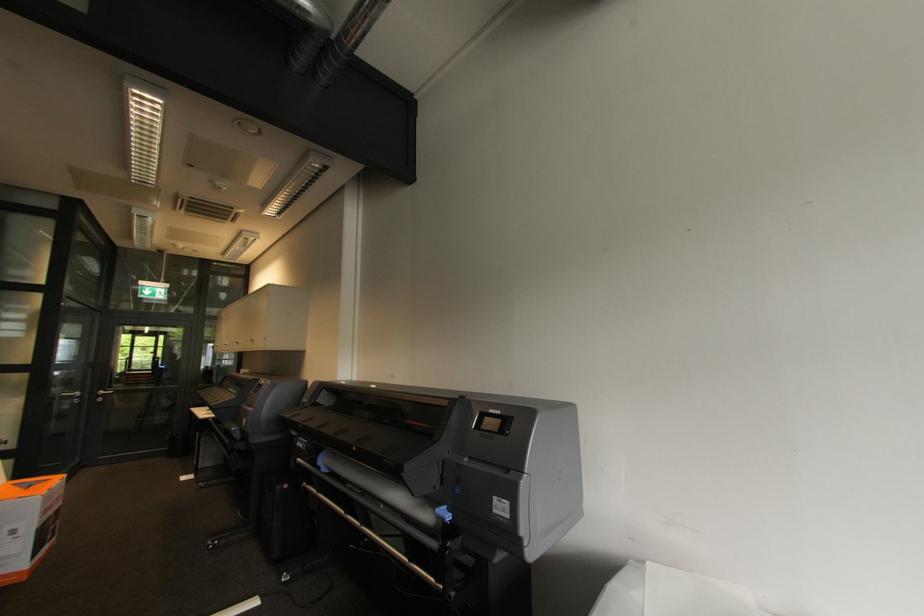
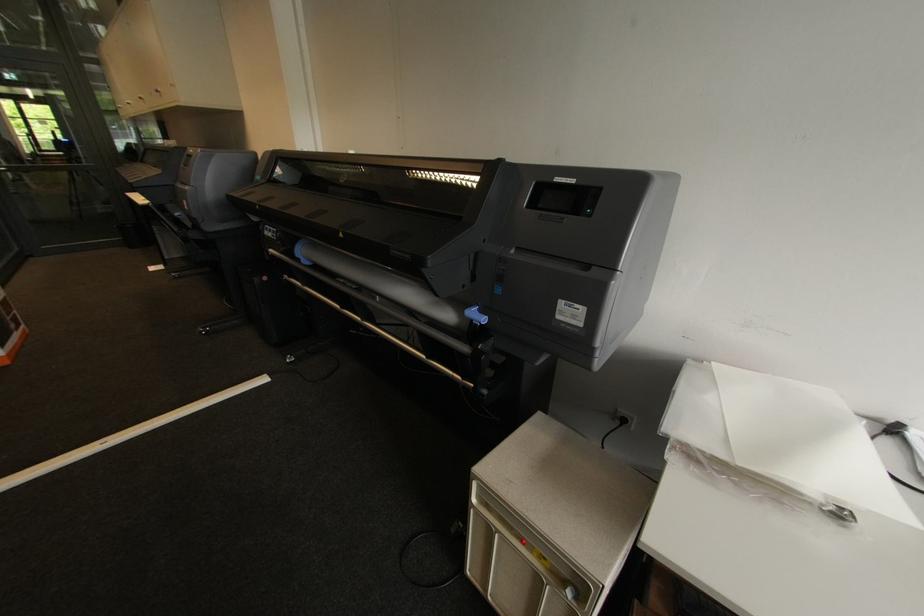
The point at (x=447, y=509) is marked in the first image. Where is the corresponding point in the second image?

(479, 310)